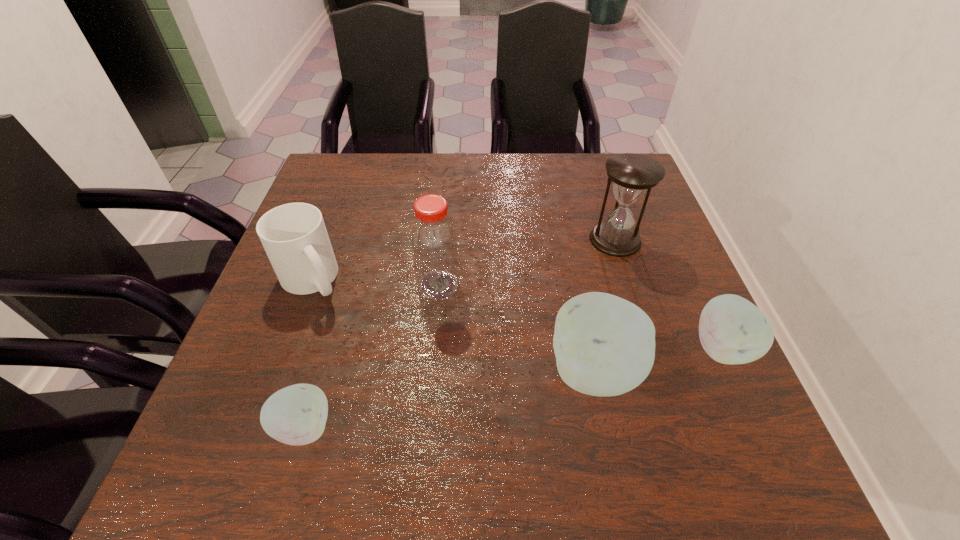
At what (x,y) coordinates should I click in order to perform the action: click on free space between the bottle and the mug. Please return your answer as a coordinate pair (x, y). The width and height of the screenshot is (960, 540). Looking at the image, I should click on (375, 283).

This screenshot has width=960, height=540. I want to click on free space between the bottle and the mug, so click(375, 283).

The width and height of the screenshot is (960, 540). What are the coordinates of `the fifth closest object to the fifth tallest object` in the screenshot? It's located at (294, 236).

Locate an element on the screen. the closest object to the second apple from right to left is located at coordinates (732, 330).

Locate which apple ranks in proximity to the shortest object. Please provide its 2D coordinates. Your answer should be formatted as a tuple, i.e. [(x, y)], where the tuple contains the x and y coordinates of a point satisfying the conditions above.

[(604, 345)]

I want to click on apple that can be found as the second closest to the mug, so click(x=604, y=345).

The height and width of the screenshot is (540, 960). Find the location of `free space that satisfies the following two spatial constraints: 1. on the front side of the leftmost apple; 2. on the right side of the mug`. free space that satisfies the following two spatial constraints: 1. on the front side of the leftmost apple; 2. on the right side of the mug is located at coordinates (258, 428).

Where is `free spot that satisfies the following two spatial constraints: 1. on the front side of the bottle; 2. on the right side of the second apple from left to right`? free spot that satisfies the following two spatial constraints: 1. on the front side of the bottle; 2. on the right side of the second apple from left to right is located at coordinates (431, 372).

Image resolution: width=960 pixels, height=540 pixels. What are the coordinates of `free space that satisfies the following two spatial constraints: 1. on the front side of the mug; 2. on the right side of the second apple from left to right` in the screenshot? It's located at (278, 372).

The height and width of the screenshot is (540, 960). Identify the location of blank area in the image that satisfies the following two spatial constraints: 1. on the front side of the hourglass; 2. on the right side of the second shortest apple. (650, 348).